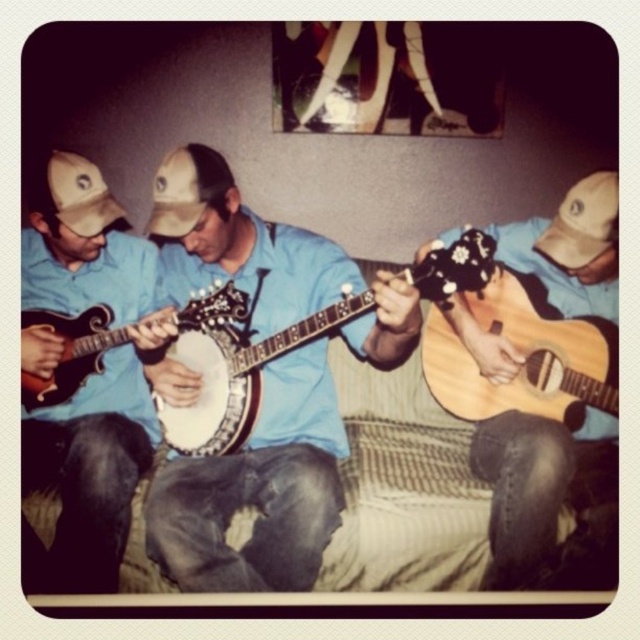
You are a photographer setting up for a group photo. You need to ensure that the natural wood acoustic guitar at center and the brown fabric baseball cap at left are both visible in the frame. Given their sizes, which object might require more careful positioning to avoid being cut off?

The natural wood acoustic guitar at center is much taller than the brown fabric baseball cap at left, so it might require more careful positioning to avoid being cut off due to its greater height.

You are a photographer setting up a shot of the three musicians. You need to focus on the natural wood acoustic guitar at center. Given that the point at coordinates (x=524, y=356) is part of the guitar, where should you aim your camera to capture the entire instrument?

The point at coordinates (x=524, y=356) corresponds to the natural wood acoustic guitar at center, so aim the camera at the center area where the natural wood acoustic guitar at center is located to capture it fully.

You are a photographer setting up a tripod to capture a closeup of the instruments. The banjo and the cap are both in your viewfinder. Since the matte white banjo at center is taller than the brown fabric baseball cap at left, which object should you focus on first if you want to ensure both are in focus?

The matte white banjo at center is taller than the brown fabric baseball cap at left, so you should focus on the matte white banjo at center first to ensure both are in focus.